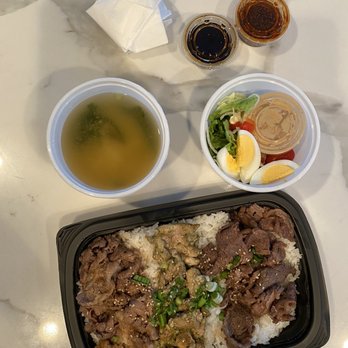
Where is `bowl`? The height and width of the screenshot is (348, 348). bowl is located at coordinates (166, 143).